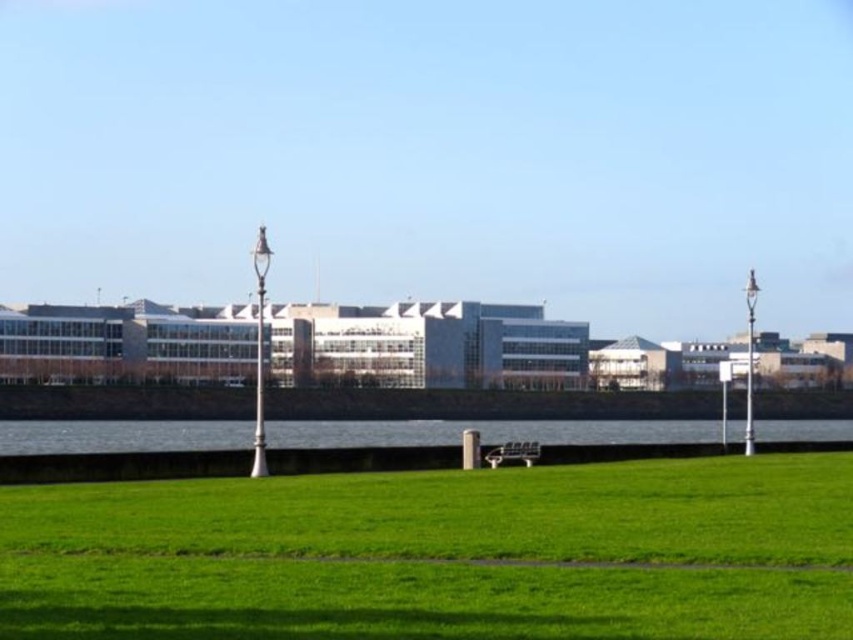
Question: Where is green grassy field at lower center located in relation to wooden park bench at center in the image?

Choices:
 (A) right
 (B) left

Answer: (B)

Question: Among these points, which one is nearest to the camera?

Choices:
 (A) (610, 632)
 (B) (495, 442)
 (C) (519, 448)

Answer: (A)

Question: Can you confirm if green grassy field at lower center is thinner than blue glass water at center?

Choices:
 (A) no
 (B) yes

Answer: (B)

Question: Can you confirm if green grassy field at lower center is wider than blue glass water at center?

Choices:
 (A) yes
 (B) no

Answer: (B)

Question: Which of the following is the closest to the observer?

Choices:
 (A) (776, 426)
 (B) (830, 483)

Answer: (B)

Question: Which of the following is the closest to the observer?

Choices:
 (A) (160, 420)
 (B) (485, 460)
 (C) (335, 589)

Answer: (C)